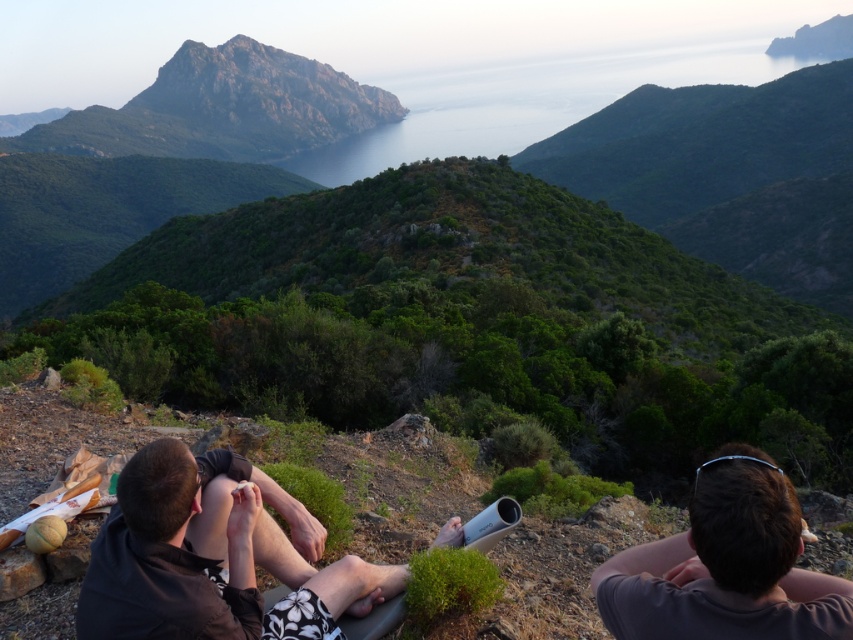
I want to click on dark brown leather jacket at lower left, so click(210, 563).

Who is positioned more to the right, dark brown leather jacket at lower left or rugged stone peak at upper center?

From the viewer's perspective, dark brown leather jacket at lower left appears more on the right side.

Identify the location of dark brown leather jacket at lower left. This screenshot has height=640, width=853. (210, 563).

Is brown hair at center wider than rugged stone peak at upper center?

No.

How distant is brown hair at center from rugged stone peak at upper center?

brown hair at center and rugged stone peak at upper center are 837.70 meters apart.

Between point (654, 611) and point (334, 93), which one is positioned in front?

Positioned in front is point (654, 611).

The width and height of the screenshot is (853, 640). What are the coordinates of `brown hair at center` in the screenshot? It's located at (724, 568).

Does dark brown leather jacket at lower left have a greater width compared to brown hair at center?

Yes, dark brown leather jacket at lower left is wider than brown hair at center.

Based on the photo, which of these two, dark brown leather jacket at lower left or brown hair at center, stands shorter?

Standing shorter between the two is brown hair at center.

Which is in front, point (270, 570) or point (711, 506)?

Positioned in front is point (711, 506).

The image size is (853, 640). In order to click on dark brown leather jacket at lower left in this screenshot , I will do `click(210, 563)`.